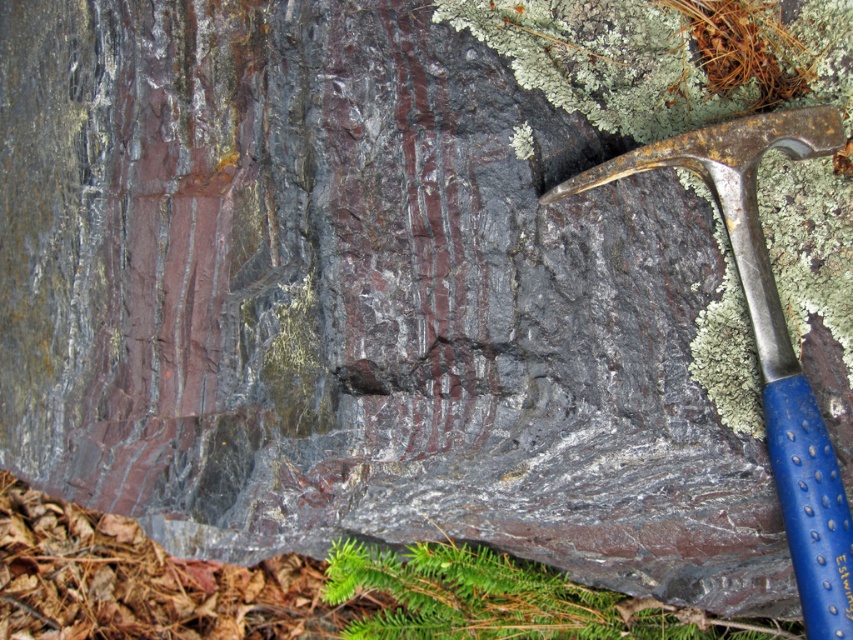
Question: Which point is farther to the camera?

Choices:
 (A) blue plastic hammer at right
 (B) blue rubber hammer at lower right

Answer: (A)

Question: Which object is closer to the camera taking this photo?

Choices:
 (A) blue plastic hammer at right
 (B) blue rubber hammer at lower right

Answer: (B)

Question: Is blue plastic hammer at right wider than blue rubber hammer at lower right?

Choices:
 (A) yes
 (B) no

Answer: (A)

Question: In this image, where is blue plastic hammer at right located relative to blue rubber hammer at lower right?

Choices:
 (A) left
 (B) right

Answer: (A)

Question: Which point is closer to the camera taking this photo?

Choices:
 (A) (849, 557)
 (B) (790, 544)

Answer: (A)

Question: Considering the relative positions of blue plastic hammer at right and blue rubber hammer at lower right in the image provided, where is blue plastic hammer at right located with respect to blue rubber hammer at lower right?

Choices:
 (A) below
 (B) above

Answer: (B)